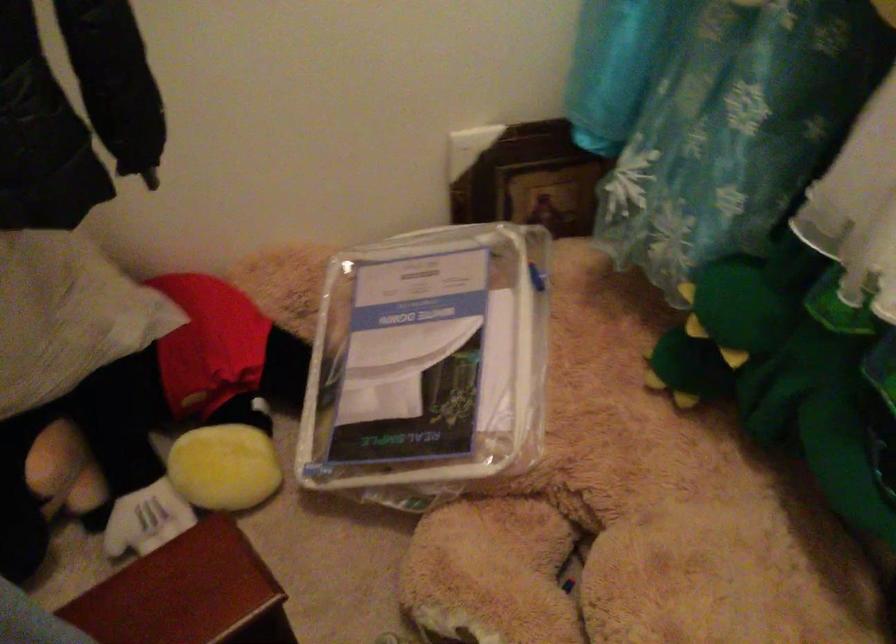
Find the location of a particular element. Image resolution: width=896 pixels, height=644 pixels. small picture frame is located at coordinates (530, 180).